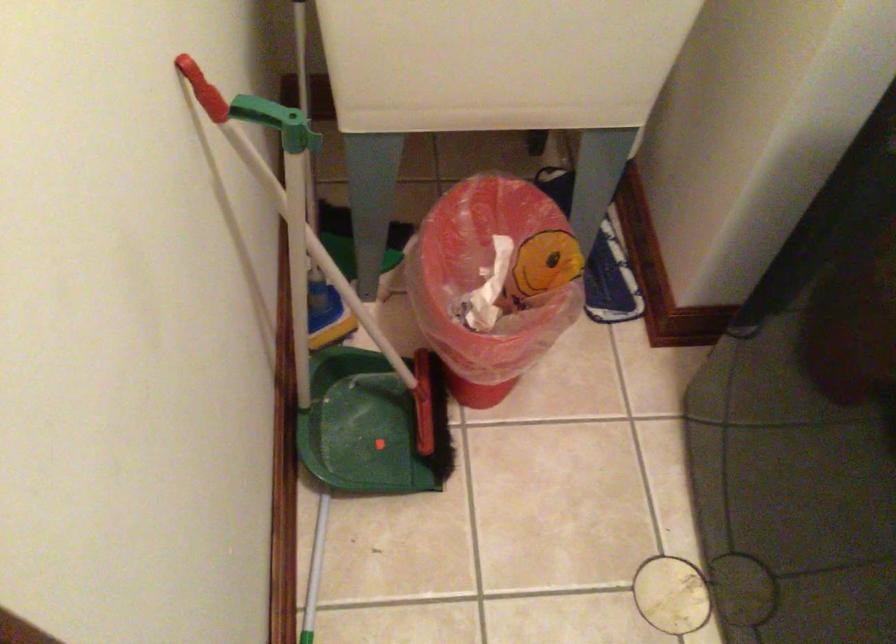
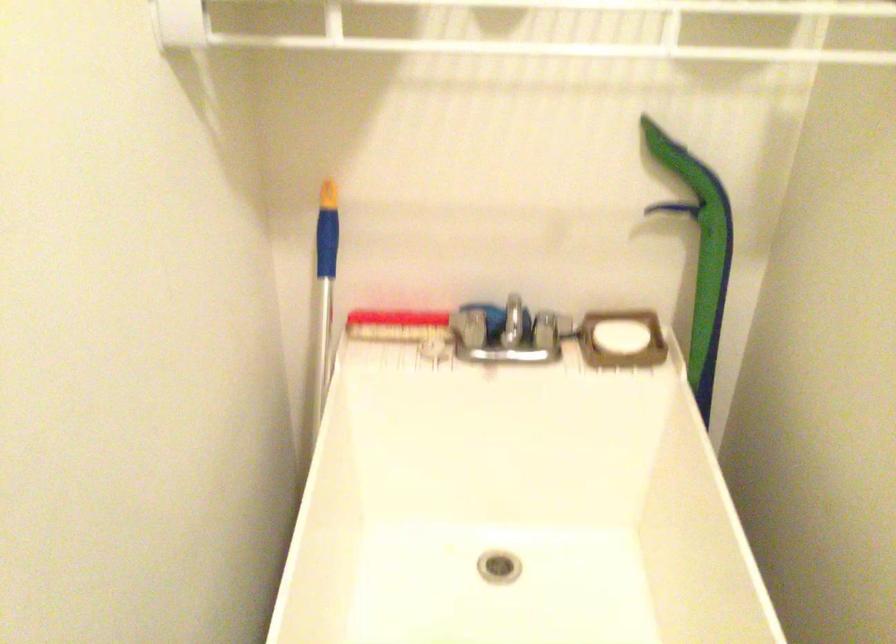
Question: The images are taken continuously from a first-person perspective. In which direction is your viewpoint rotating?

Choices:
 (A) Left
 (B) Right
 (C) Up
 (D) Down

Answer: (C)